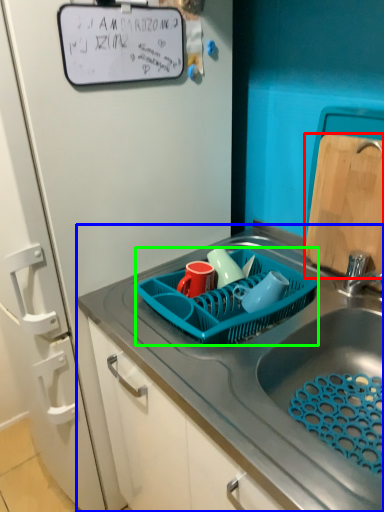
Question: Which object is positioned closest to cutting board (highlighted by a red box)? Select from sink (highlighted by a blue box) and basket (highlighted by a green box).

Choices:
 (A) sink
 (B) basket

Answer: (B)